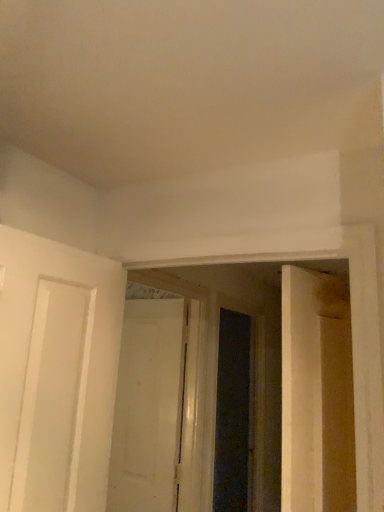
Question: Is white matte door at center surrounded by transparent glass screen door at center?

Choices:
 (A) yes
 (B) no

Answer: (B)

Question: Is transparent glass screen door at center far away from white matte door at center?

Choices:
 (A) yes
 (B) no

Answer: (A)

Question: Are transparent glass screen door at center and white matte door at center making contact?

Choices:
 (A) yes
 (B) no

Answer: (B)

Question: From a real-world perspective, is transparent glass screen door at center over white matte door at center?

Choices:
 (A) yes
 (B) no

Answer: (B)

Question: Is transparent glass screen door at center thinner than white matte door at center?

Choices:
 (A) yes
 (B) no

Answer: (B)

Question: Does transparent glass screen door at center turn towards white matte door at center?

Choices:
 (A) no
 (B) yes

Answer: (A)

Question: Is white matte door at center wider than transparent glass screen door at center?

Choices:
 (A) yes
 (B) no

Answer: (B)

Question: Can you confirm if white matte door at center is smaller than transparent glass screen door at center?

Choices:
 (A) no
 (B) yes

Answer: (B)

Question: Is the depth of white matte door at center greater than that of transparent glass screen door at center?

Choices:
 (A) yes
 (B) no

Answer: (B)

Question: Does white matte door at center have a lesser width compared to transparent glass screen door at center?

Choices:
 (A) yes
 (B) no

Answer: (A)

Question: From a real-world perspective, is white matte door at center below transparent glass screen door at center?

Choices:
 (A) yes
 (B) no

Answer: (B)

Question: Is white matte door at center turned away from transparent glass screen door at center?

Choices:
 (A) yes
 (B) no

Answer: (A)

Question: In terms of size, does white matte door at center appear bigger or smaller than transparent glass screen door at center?

Choices:
 (A) small
 (B) big

Answer: (A)